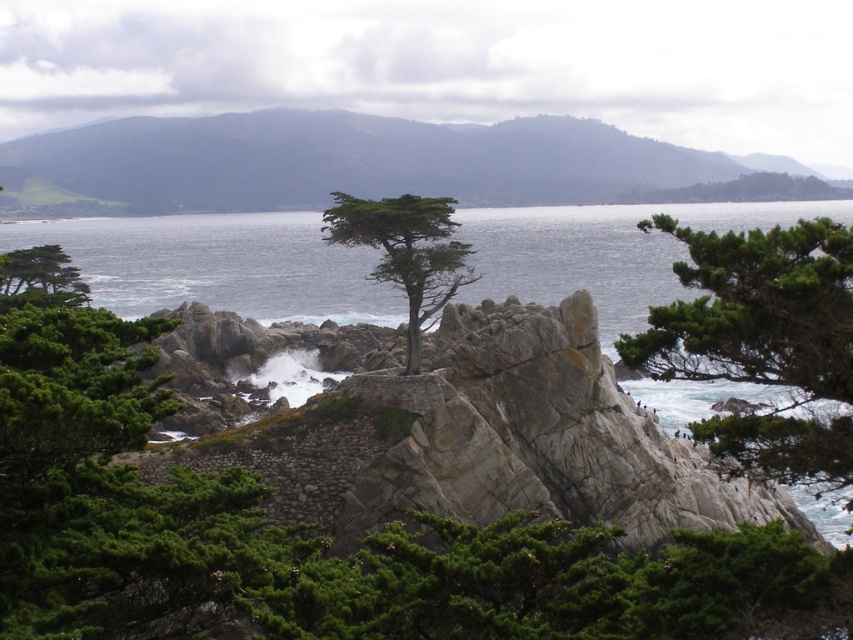
Question: Does gray water at center come behind green textured tree at center?

Choices:
 (A) yes
 (B) no

Answer: (B)

Question: In this image, where is gray water at center located relative to green textured tree at center?

Choices:
 (A) above
 (B) below

Answer: (A)

Question: Which object is positioned closest to the green textured pine tree at right?

Choices:
 (A) green matte tree at left
 (B) gray water at center

Answer: (A)

Question: Which point is farther to the camera?

Choices:
 (A) gray water at center
 (B) green textured tree at center
 (C) green matte tree at left

Answer: (B)

Question: Does gray water at center lie in front of green matte tree at left?

Choices:
 (A) yes
 (B) no

Answer: (A)

Question: Which point appears farthest from the camera in this image?

Choices:
 (A) (415, 260)
 (B) (838, 464)
 (C) (20, 276)
 (D) (77, 234)

Answer: (D)